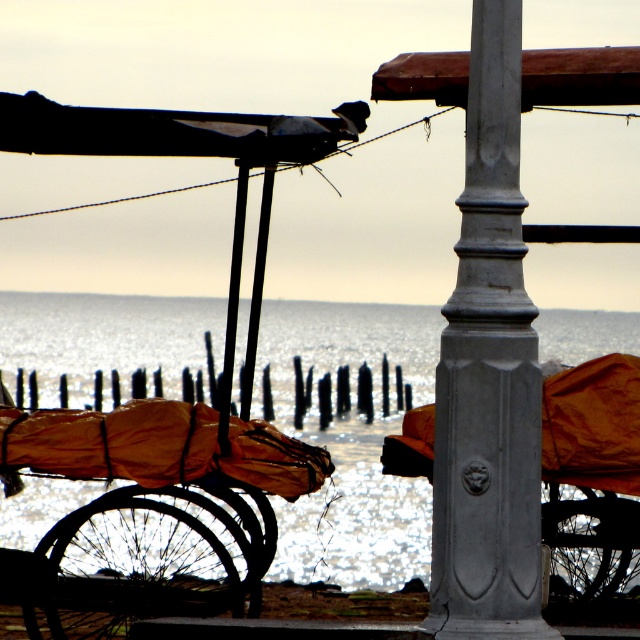
Is shiny metallic water at center thinner than gray polished metal pole at center?

In fact, shiny metallic water at center might be wider than gray polished metal pole at center.

Is shiny metallic water at center positioned at the back of gray polished metal pole at center?

Yes, shiny metallic water at center is further from the viewer.

Is point (554, 310) farther from viewer compared to point (518, 589)?

Yes, it is behind point (518, 589).

The image size is (640, 640). I want to click on shiny metallic water at center, so click(349, 442).